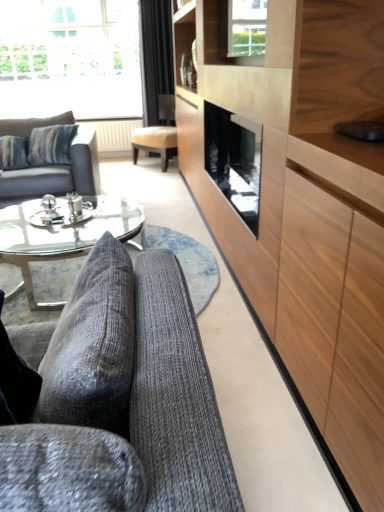
Question: From the image's perspective, is beige fabric chair at center located above or below black velvet curtain at upper center?

Choices:
 (A) above
 (B) below

Answer: (B)

Question: Considering the positions of beige fabric chair at center and black velvet curtain at upper center in the image, is beige fabric chair at center wider or thinner than black velvet curtain at upper center?

Choices:
 (A) wide
 (B) thin

Answer: (A)

Question: Which of these objects is positioned farthest from the black velvet curtain at upper center?

Choices:
 (A) transparent glass window at upper left, placed as the 2th window when sorted from bottom to top
 (B) textured gray fabric couch at lower left, which is the 2th studio couch in left-to-right order
 (C) transparent glass coffee table at center
 (D) matte gray fabric couch at left, the first studio couch when ordered from left to right
 (E) clear glass window at upper center, the second window from the top

Answer: (B)

Question: Which of these objects is positioned farthest from the textured gray fabric couch at lower left, the 2th studio couch viewed from the back?

Choices:
 (A) matte gray fabric couch at left, which ranks as the second studio couch in right-to-left order
 (B) black velvet curtain at upper center
 (C) clear glass window at upper center, placed as the 2th window when sorted from left to right
 (D) transparent glass window at upper left, the second window positioned from the front
 (E) beige fabric chair at center

Answer: (D)